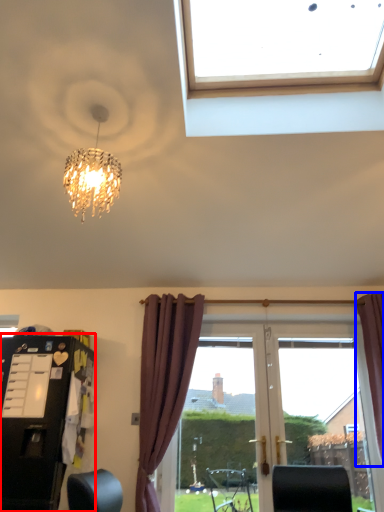
Question: Which object appears closest to the camera in this image, dresser (highlighted by a red box) or curtain (highlighted by a blue box)?

Choices:
 (A) dresser
 (B) curtain

Answer: (A)